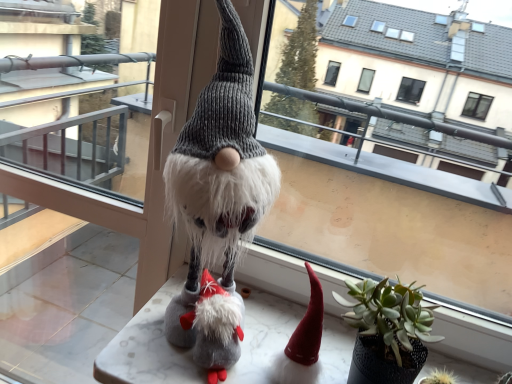
What do you see at coordinates (58, 299) in the screenshot?
I see `transparent glass door at center` at bounding box center [58, 299].

I want to click on fuzzy gray knit gnome at center, so click(218, 195).

In terms of height, does green matte houseplant at center look taller or shorter compared to fuzzy gray knit gnome at center?

Clearly, green matte houseplant at center is shorter compared to fuzzy gray knit gnome at center.

Choose the correct answer: Is green matte houseplant at center inside fuzzy gray knit gnome at center or outside it?

green matte houseplant at center lies outside fuzzy gray knit gnome at center.

From the image's perspective, which object appears higher, green matte houseplant at center or fuzzy gray knit gnome at center?

fuzzy gray knit gnome at center appears higher in the image.

Is fuzzy gray knit gnome at center taller or shorter than transparent glass door at center?

Clearly, fuzzy gray knit gnome at center is shorter compared to transparent glass door at center.

From a real-world perspective, is fuzzy gray knit gnome at center positioned above or below transparent glass door at center?

In terms of real-world spatial position, fuzzy gray knit gnome at center is above transparent glass door at center.

Which is more to the left, fuzzy gray knit gnome at center or transparent glass door at center?

transparent glass door at center is more to the left.

Considering the relative sizes of marble table at center and transparent glass door at center in the image provided, is marble table at center wider than transparent glass door at center?

Yes.

From the picture: Are marble table at center and transparent glass door at center beside each other?

No, marble table at center is not beside transparent glass door at center.

Is transparent glass door at center completely or partially inside marble table at center?

No, transparent glass door at center is not inside marble table at center.

In the scene shown: Is marble table at center bigger or smaller than transparent glass door at center?

marble table at center is smaller than transparent glass door at center.

Between green matte houseplant at center and marble table at center, which one appears on the right side from the viewer's perspective?

green matte houseplant at center is more to the right.

Considering the relative positions of green matte houseplant at center and marble table at center in the image provided, is green matte houseplant at center in front of marble table at center?

No, green matte houseplant at center is further to the viewer.

From a real-world perspective, is green matte houseplant at center located higher than marble table at center?

Yes, from a real-world perspective, green matte houseplant at center is on top of marble table at center.

From the image's perspective, is green matte houseplant at center under marble table at center?

Incorrect, from the image's perspective, green matte houseplant at center is higher than marble table at center.

Is transparent glass door at center bigger than marble table at center?

Correct, transparent glass door at center is larger in size than marble table at center.

Looking at their sizes, would you say transparent glass door at center is wider or thinner than marble table at center?

transparent glass door at center is thinner than marble table at center.

From the image's perspective, which one is positioned higher, transparent glass door at center or marble table at center?

transparent glass door at center appears higher in the image.

Visually, is marble table at center positioned to the left or to the right of green matte houseplant at center?

From the image, it's evident that marble table at center is to the left of green matte houseplant at center.

Is marble table at center wider or thinner than green matte houseplant at center?

Clearly, marble table at center has more width compared to green matte houseplant at center.

Choose the correct answer: Is marble table at center inside green matte houseplant at center or outside it?

The correct answer is: outside.

Considering the sizes of objects fuzzy gray knit gnome at center and green matte houseplant at center in the image provided, who is taller, fuzzy gray knit gnome at center or green matte houseplant at center?

fuzzy gray knit gnome at center.

From the image's perspective, which is below, fuzzy gray knit gnome at center or green matte houseplant at center?

green matte houseplant at center, from the image's perspective.

Is fuzzy gray knit gnome at center bigger than green matte houseplant at center?

Correct, fuzzy gray knit gnome at center is larger in size than green matte houseplant at center.

How much distance is there between fuzzy gray knit gnome at center and green matte houseplant at center?

fuzzy gray knit gnome at center is 10.99 inches away from green matte houseplant at center.

This screenshot has width=512, height=384. What are the coordinates of `figurine above the green matte houseplant at center (from the image's perspective)` in the screenshot? It's located at (218, 195).

Where is `glass door behind the fuzzy gray knit gnome at center`? glass door behind the fuzzy gray knit gnome at center is located at coordinates (58, 299).

Looking at this image, which object lies further to the anchor point transparent glass door at center, fuzzy gray knit gnome at center or green matte houseplant at center?

The object further to transparent glass door at center is green matte houseplant at center.

Considering their positions, is transparent glass door at center positioned further to fuzzy gray knit gnome at center than marble table at center?

The object further to fuzzy gray knit gnome at center is transparent glass door at center.

When comparing their distances from transparent glass door at center, does green matte houseplant at center or fuzzy gray knit gnome at center seem closer?

fuzzy gray knit gnome at center.

From the image, which object appears to be nearer to marble table at center, green matte houseplant at center or fuzzy gray knit gnome at center?

Among the two, green matte houseplant at center is located nearer to marble table at center.

Looking at the image, which one is located closer to transparent glass door at center, green matte houseplant at center or marble table at center?

marble table at center lies closer to transparent glass door at center than the other object.

Looking at the image, which one is located closer to fuzzy gray knit gnome at center, green matte houseplant at center or marble table at center?

marble table at center.

Estimate the real-world distances between objects in this image. Which object is closer to transparent glass door at center, marble table at center or fuzzy gray knit gnome at center?

marble table at center is closer to transparent glass door at center.

Based on the photo, based on their spatial positions, is fuzzy gray knit gnome at center or marble table at center closer to green matte houseplant at center?

marble table at center.

The height and width of the screenshot is (384, 512). Find the location of `figurine between transparent glass door at center and marble table at center from left to right`. figurine between transparent glass door at center and marble table at center from left to right is located at coordinates (218, 195).

You are a GUI agent. You are given a task and a screenshot of the screen. Output one action in this format:
    pyautogui.click(x=<x>, y=<y>)
    Task: Click on the houseplant between fuzzy gray knit gnome at center and marble table at center in the vertical direction
    Image resolution: width=512 pixels, height=384 pixels.
    Given the screenshot: What is the action you would take?
    pyautogui.click(x=387, y=331)

Identify the location of figurine between transparent glass door at center and green matte houseplant at center. The image size is (512, 384). (218, 195).

Where is `table situated between transparent glass door at center and green matte houseplant at center from left to right`? The height and width of the screenshot is (384, 512). table situated between transparent glass door at center and green matte houseplant at center from left to right is located at coordinates (148, 347).